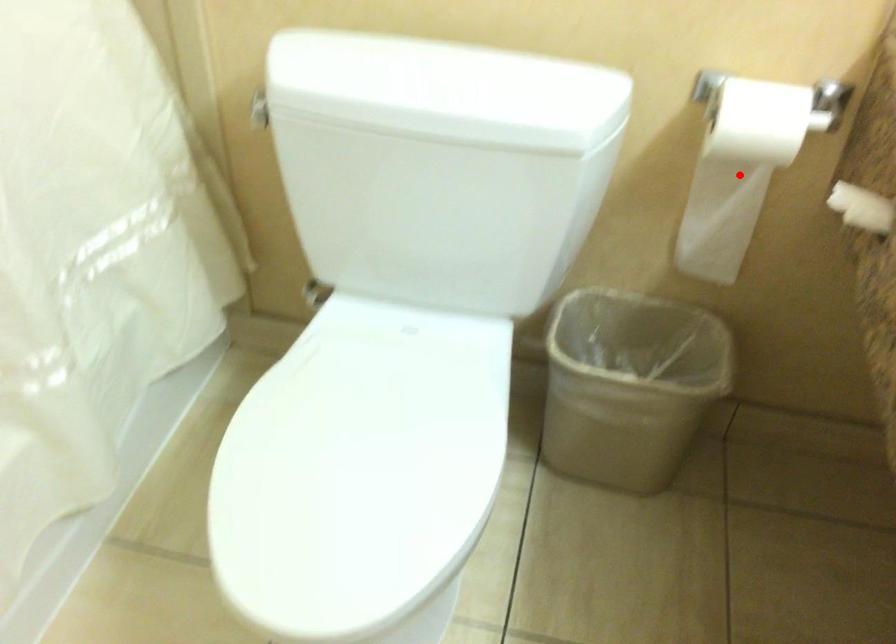
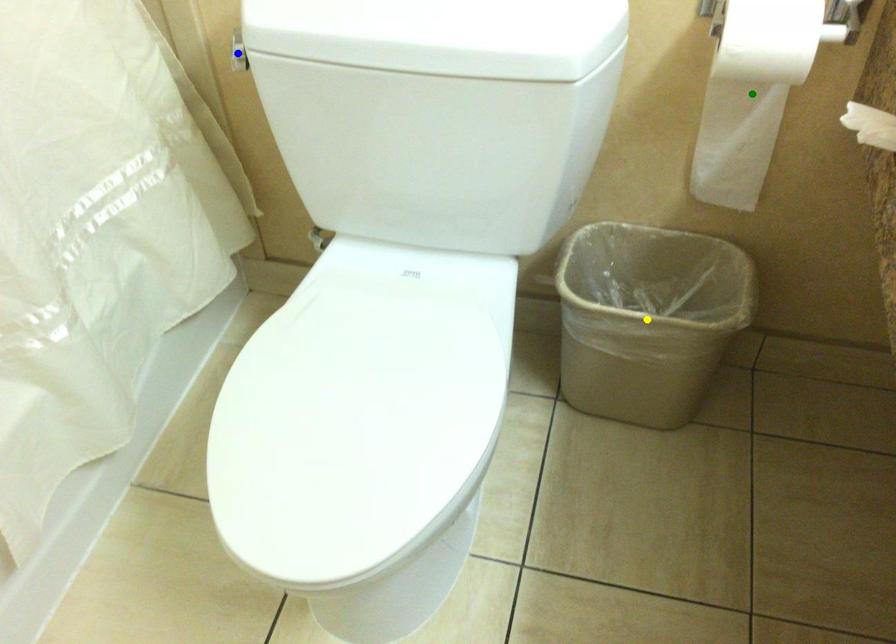
Question: I am providing you with two images of the same scene from different viewpoints. A red point is marked on the first image. You are given multiple points on the second image. Which point in image 2 represents the same 3d spot as the red point in image 1?

Choices:
 (A) green point
 (B) blue point
 (C) yellow point

Answer: (A)